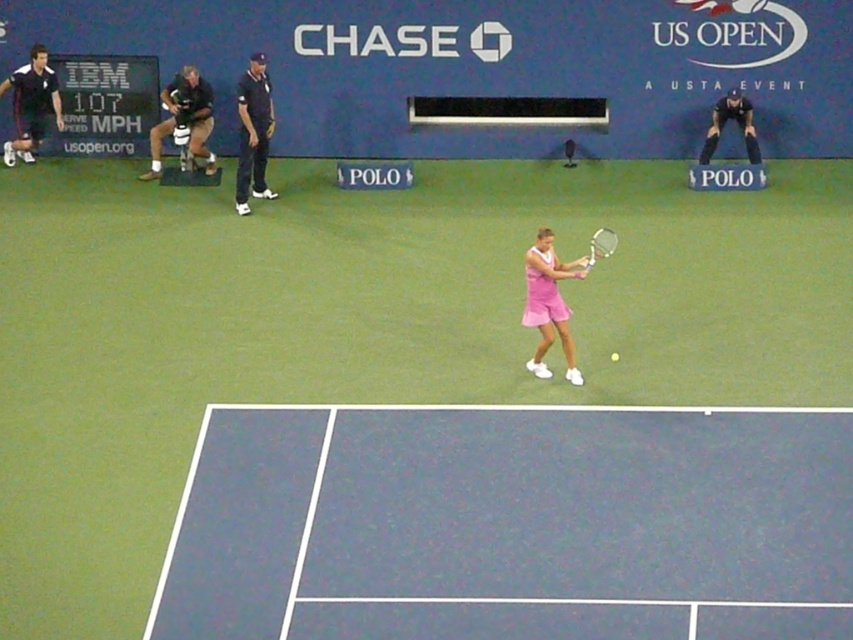
Question: Is blue rubber tennis court at center closer to the viewer compared to white plastic tennis racket at center?

Choices:
 (A) no
 (B) yes

Answer: (B)

Question: Which point is closer to the camera?

Choices:
 (A) (602, 244)
 (B) (465, 600)

Answer: (B)

Question: Which object appears closest to the camera in this image?

Choices:
 (A) pink fabric tennis outfit at center
 (B) blue rubber tennis court at center
 (C) white plastic tennis racket at center

Answer: (B)

Question: Which object is farther from the camera taking this photo?

Choices:
 (A) pink fabric tennis outfit at center
 (B) blue rubber tennis court at center

Answer: (A)

Question: Does pink fabric tennis outfit at center have a larger size compared to white plastic tennis racket at center?

Choices:
 (A) yes
 (B) no

Answer: (A)

Question: Does blue rubber tennis court at center come behind white plastic tennis racket at center?

Choices:
 (A) no
 (B) yes

Answer: (A)